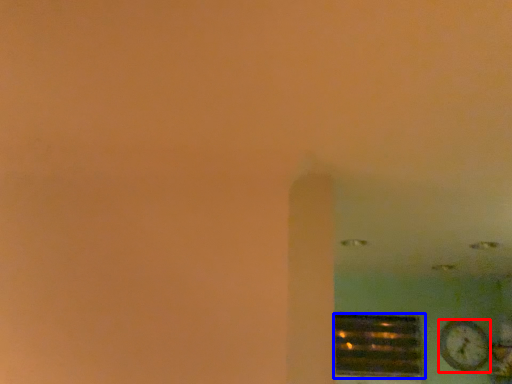
Question: Which of the following is the farthest to the observer, clock (highlighted by a red box) or window (highlighted by a blue box)?

Choices:
 (A) clock
 (B) window

Answer: (B)